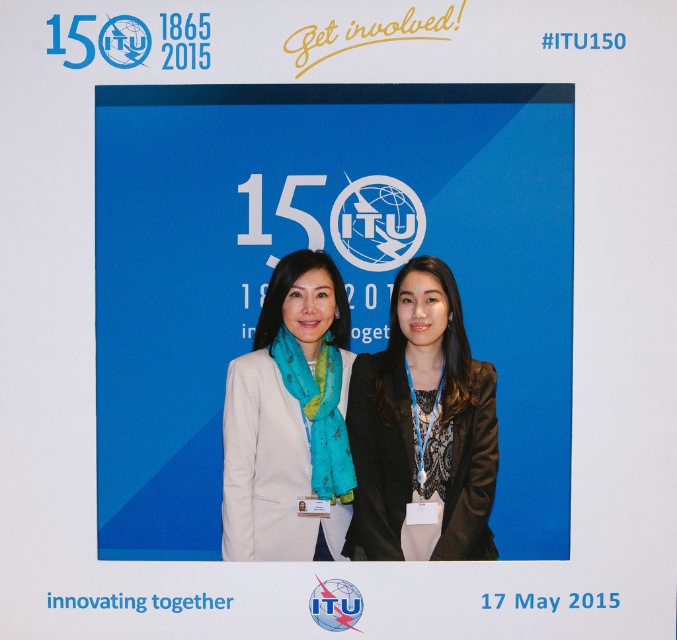
Question: Where is black lace blazer at center located in relation to matte white blazer at center in the image?

Choices:
 (A) left
 (B) right

Answer: (B)

Question: Is black lace blazer at center wider than matte white blazer at center?

Choices:
 (A) no
 (B) yes

Answer: (B)

Question: Is black lace blazer at center positioned in front of matte white blazer at center?

Choices:
 (A) yes
 (B) no

Answer: (A)

Question: Which of the following is the farthest from the observer?

Choices:
 (A) matte white blazer at center
 (B) black lace blazer at center

Answer: (A)